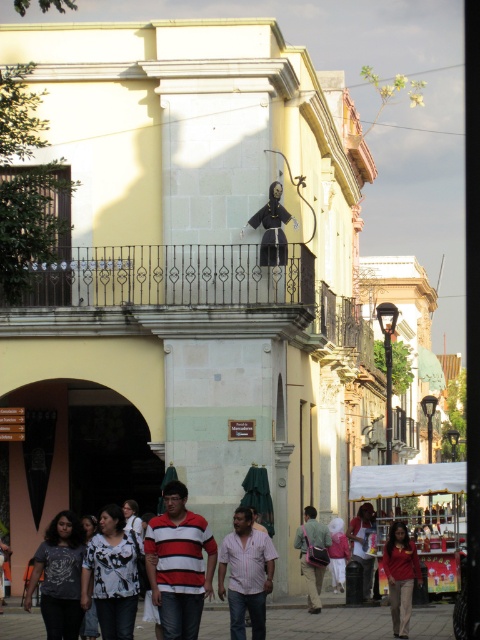
At what (x,y) coordinates should I click in order to perform the action: click on matte black statue at center. Please return your answer as a coordinate pair (x, y). The width and height of the screenshot is (480, 640). Looking at the image, I should click on (273, 227).

Between point (292, 221) and point (355, 541), which one is positioned in front?

Point (292, 221)

Between point (276, 202) and point (356, 552), which one is positioned in front?

Point (276, 202)

Find the location of `matte black statue at center`. matte black statue at center is located at coordinates (273, 227).

Between point (227, 547) and point (308, 609), which one is positioned in front?

Point (227, 547) is more forward.

Does pink striped shirt at center have a greater height compared to matte pink bag at center?

Yes, pink striped shirt at center is taller than matte pink bag at center.

Who is more forward, (267, 564) or (312, 513)?

Positioned in front is point (267, 564).

This screenshot has height=640, width=480. I want to click on pink striped shirt at center, so click(x=245, y=573).

Who is more distant from viewer, (418, 572) or (348, 550)?

Point (348, 550)

Which is more to the left, matte red shirt at lower right or light brown leather jacket at center?

light brown leather jacket at center is more to the left.

Locate an element on the screen. This screenshot has height=640, width=480. matte red shirt at lower right is located at coordinates (400, 576).